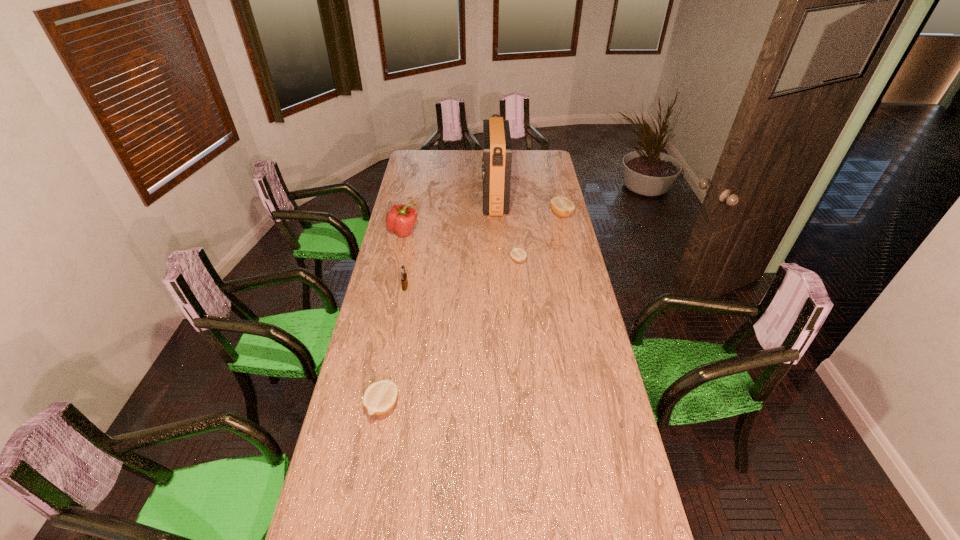
Where is `the second shortest object`? This screenshot has height=540, width=960. the second shortest object is located at coordinates (380, 397).

Where is `the nearest object`? The height and width of the screenshot is (540, 960). the nearest object is located at coordinates (380, 397).

Where is `the second farthest lemon`? The width and height of the screenshot is (960, 540). the second farthest lemon is located at coordinates (518, 255).

Where is `the second lemon from right to left`? the second lemon from right to left is located at coordinates (518, 255).

This screenshot has height=540, width=960. Find the location of `the farthest lemon`. the farthest lemon is located at coordinates click(x=562, y=207).

The width and height of the screenshot is (960, 540). In order to click on the rightmost lemon in this screenshot , I will do `click(562, 207)`.

Find the location of a particular element. the second tallest object is located at coordinates (400, 219).

The image size is (960, 540). Find the location of `the tallest object`. the tallest object is located at coordinates (497, 148).

Identify the location of the fifth farthest object. The image size is (960, 540). (404, 281).

Locate an element on the screen. The image size is (960, 540). padlock is located at coordinates (404, 281).